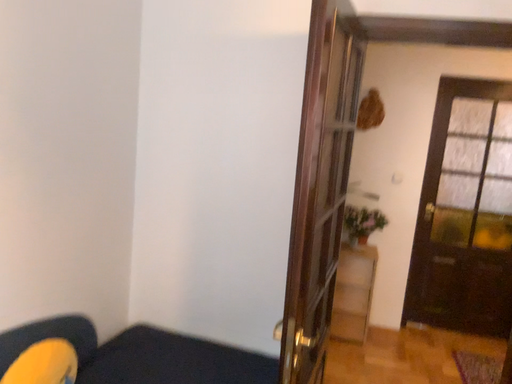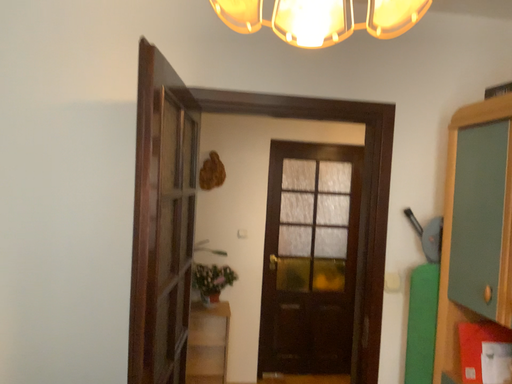
Question: How did the camera likely rotate when shooting the video?

Choices:
 (A) rotated right
 (B) rotated left

Answer: (A)